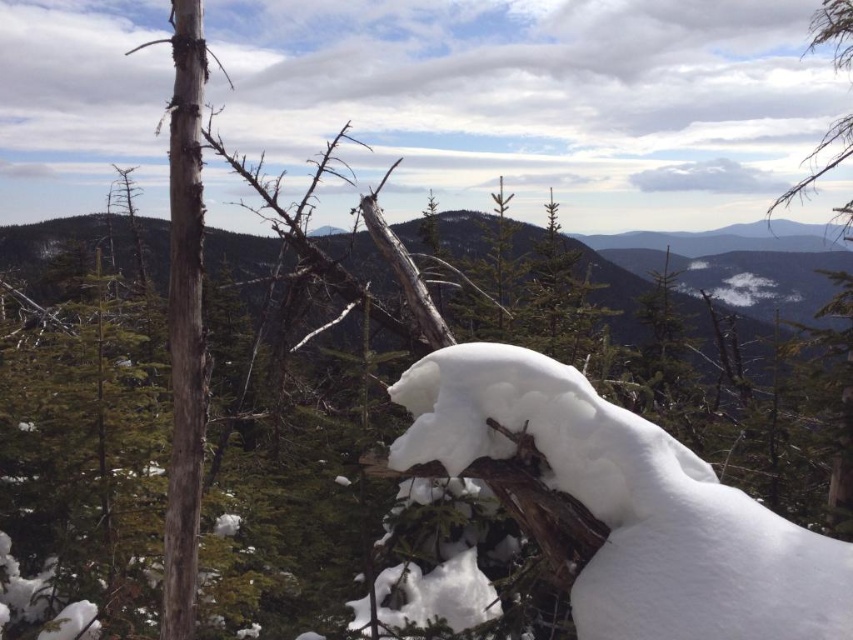
Question: Which point is farther to the camera?

Choices:
 (A) (454, 435)
 (B) (459, 243)

Answer: (B)

Question: From the image, what is the correct spatial relationship of white fluffy snow at center in relation to green matte tree at upper center?

Choices:
 (A) above
 (B) below

Answer: (B)

Question: Is white fluffy snow at center positioned before green matte tree at upper center?

Choices:
 (A) no
 (B) yes

Answer: (B)

Question: Does white fluffy snow at center appear on the left side of green matte tree at upper center?

Choices:
 (A) no
 (B) yes

Answer: (B)

Question: Which of the following is the farthest from the observer?

Choices:
 (A) (367, 257)
 (B) (758, 512)

Answer: (A)